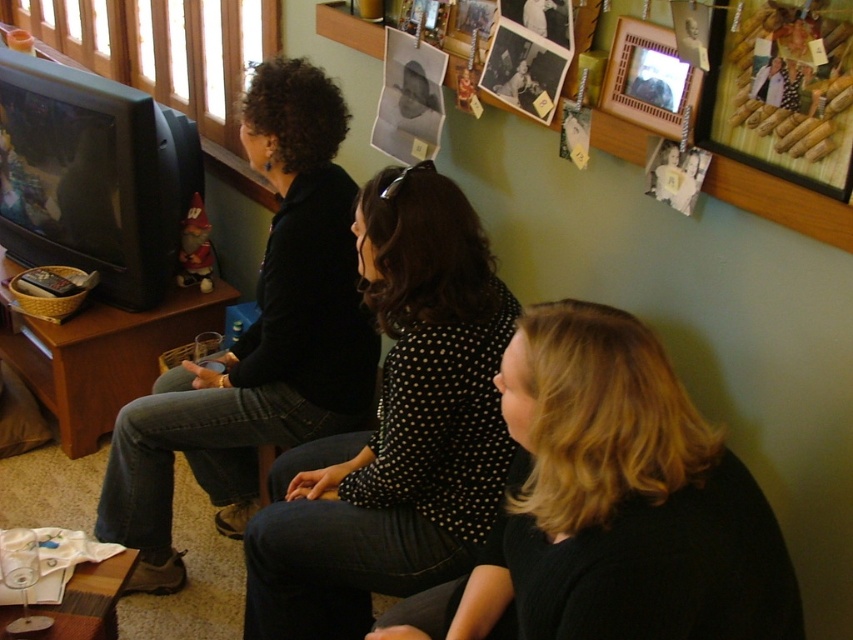
Question: Among these points, which one is farthest from the camera?

Choices:
 (A) (576, 513)
 (B) (299, 595)
 (C) (650, 116)

Answer: (C)

Question: Can you confirm if blonde hair at center is thinner than black dotted shirt at center?

Choices:
 (A) yes
 (B) no

Answer: (B)

Question: Which point is farther to the camera?

Choices:
 (A) wooden picture frame at upper right
 (B) blonde hair at center
 (C) black dotted shirt at center
 (D) black matte shirt at left

Answer: (D)

Question: Which point appears farthest from the camera in this image?

Choices:
 (A) (645, 45)
 (B) (608, 554)
 (C) (379, 541)

Answer: (A)

Question: Where is blonde hair at center located in relation to wooden picture frame at upper right in the image?

Choices:
 (A) below
 (B) above

Answer: (A)

Question: Does blonde hair at center appear on the right side of wooden picture frame at upper right?

Choices:
 (A) yes
 (B) no

Answer: (B)